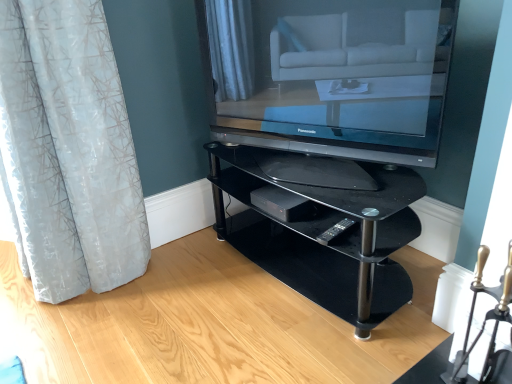
Question: Considering the positions of translucent white curtain at left and matte black television at center in the image, is translucent white curtain at left taller or shorter than matte black television at center?

Choices:
 (A) tall
 (B) short

Answer: (A)

Question: Which is correct: translucent white curtain at left is inside matte black television at center, or outside of it?

Choices:
 (A) inside
 (B) outside

Answer: (B)

Question: Which is farther from the matte black television at center?

Choices:
 (A) black plastic remote at lower center
 (B) translucent white curtain at left
 (C) black glass shelf at center

Answer: (B)

Question: Which of these objects is positioned farthest from the black plastic remote at lower center?

Choices:
 (A) matte black television at center
 (B) black glass shelf at center
 (C) translucent white curtain at left

Answer: (C)